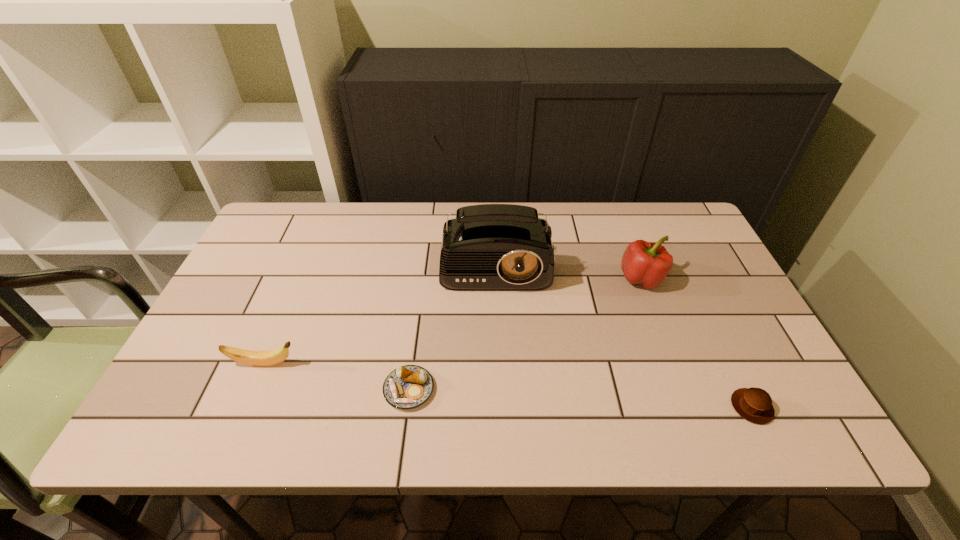
What are the coordinates of `empty space that is in between the tallest object and the second tallest object` in the screenshot? It's located at (568, 266).

Locate an element on the screen. free space between the radio receiver and the shortest object is located at coordinates (452, 322).

Identify the location of unoccupied position between the tallest object and the bell pepper. (568, 266).

At what (x,y) coordinates should I click in order to perform the action: click on vacant region between the leftmost object and the tallest object. Please return your answer as a coordinate pair (x, y). This screenshot has width=960, height=540. Looking at the image, I should click on (380, 309).

I want to click on object that is the third nearest to the rightmost object, so click(407, 387).

Identify which object is the third closest to the second tallest object. Please provide its 2D coordinates. Your answer should be formatted as a tuple, i.e. [(x, y)], where the tuple contains the x and y coordinates of a point satisfying the conditions above.

[(407, 387)]

Where is `free space that satisfies the following two spatial constraints: 1. at the stem of the pastry; 2. on the left side of the banana`? The height and width of the screenshot is (540, 960). free space that satisfies the following two spatial constraints: 1. at the stem of the pastry; 2. on the left side of the banana is located at coordinates (253, 389).

You are a GUI agent. You are given a task and a screenshot of the screen. Output one action in this format:
    pyautogui.click(x=<x>, y=<y>)
    Task: Click on the vacant space that satisfies the following two spatial constraints: 1. on the front-facing side of the fourth shortest object; 2. on the right side of the tallest object
    
    Given the screenshot: What is the action you would take?
    [497, 279]

Locate an element on the screen. Image resolution: width=960 pixels, height=540 pixels. vacant space that satisfies the following two spatial constraints: 1. at the stem of the banana; 2. on the left side of the pastry is located at coordinates (253, 389).